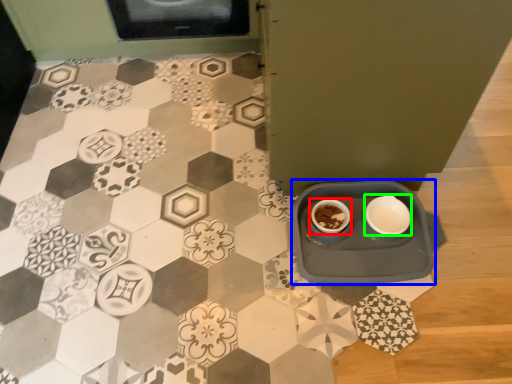
Question: Which object is positioned farthest from coffee cup (highlighted by a red box)? Select from table (highlighted by a blue box) and tableware (highlighted by a green box).

Choices:
 (A) table
 (B) tableware

Answer: (B)